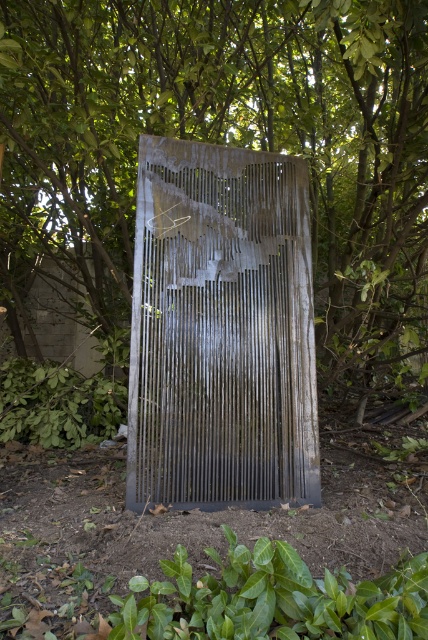
Looking at this image, does rusty metal sculpture at center appear under rusty metal screen door at center?

No, rusty metal sculpture at center is not below rusty metal screen door at center.

Who is positioned more to the left, rusty metal sculpture at center or rusty metal screen door at center?

From the viewer's perspective, rusty metal sculpture at center appears more on the left side.

You are a GUI agent. You are given a task and a screenshot of the screen. Output one action in this format:
    pyautogui.click(x=<x>, y=<y>)
    Task: Click on the rusty metal sculpture at center
    
    Given the screenshot: What is the action you would take?
    pyautogui.click(x=225, y=144)

Measure the distance between point (142, 417) and camera.

They are 2.94 meters apart.

Can you confirm if rusty metal screen door at center is positioned to the left of green leafy plant at lower center?

Yes, rusty metal screen door at center is to the left of green leafy plant at lower center.

What do you see at coordinates (220, 330) in the screenshot? I see `rusty metal screen door at center` at bounding box center [220, 330].

What are the coordinates of `rusty metal screen door at center` in the screenshot? It's located at (220, 330).

What do you see at coordinates (225, 144) in the screenshot?
I see `rusty metal sculpture at center` at bounding box center [225, 144].

Is the position of rusty metal sculpture at center more distant than that of green leafy plant at lower center?

Yes, rusty metal sculpture at center is behind green leafy plant at lower center.

In order to click on rusty metal sculpture at center in this screenshot , I will do `click(225, 144)`.